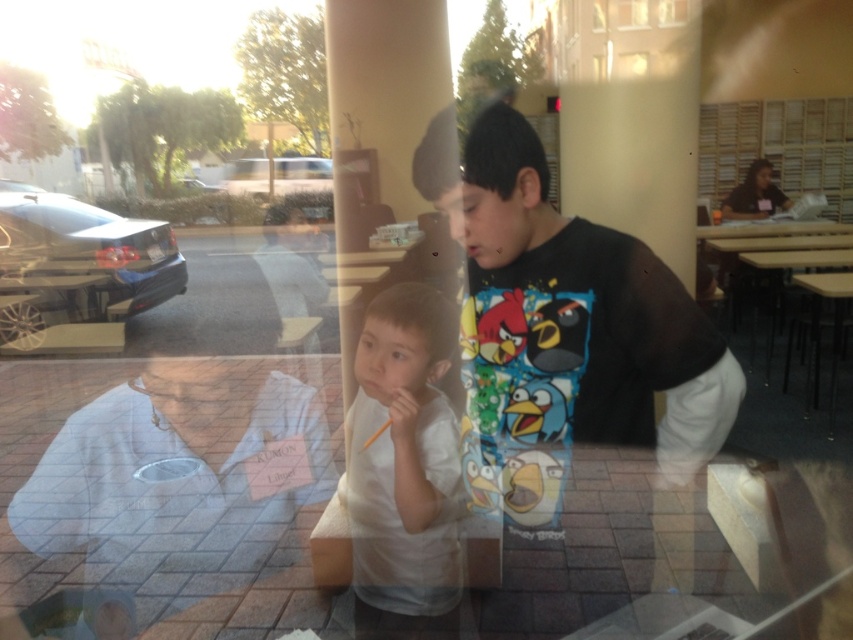
What is the location of the point with coordinates (164,492) in the image?

The point with coordinates (164,492) is located on the white fabric at the left.

You are a photographer trying to capture a photo of both point (143, 618) and point (370, 497) in the image. Which point is closer to your camera lens?

Point (143, 618) is further to the camera than point (370, 497), so point (370, 497) is closer to the camera lens.

You are a photographer trying to capture a clear shot of the white matte shirt at center and the white fabric at left. Since both are white, you need to adjust your camera settings to account for their sizes. Which object should you focus on first to ensure proper exposure, considering their sizes?

The white fabric at left is bigger than the white matte shirt at center, so you should focus on the white fabric at left first to ensure proper exposure because larger white objects can affect exposure more significantly.